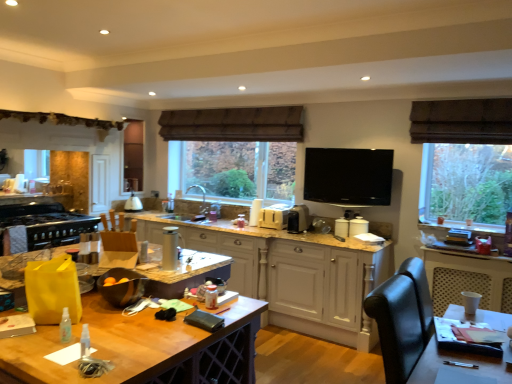
Question: Would you say white painted wood cabinetry at center is inside or outside matte white lampshade at center, positioned as the 6th appliance in front-to-back order?

Choices:
 (A) inside
 (B) outside

Answer: (B)

Question: Is white painted wood cabinetry at center in front of or behind matte white lampshade at center, the fifth appliance viewed from the right, in the image?

Choices:
 (A) front
 (B) behind

Answer: (A)

Question: Which is nearer to the satin silver toaster at center, which appears as the 3th appliance when viewed from the back?

Choices:
 (A) white painted wood cabinetry at center
 (B) black matte stove at left, positioned as the first appliance in left-to-right order
 (C) silver metallic thermos at center, the 6th appliance viewed from the back
 (D) matte white lampshade at center, positioned as the 6th appliance in front-to-back order
 (E) wooden table at center

Answer: (A)

Question: Estimate the real-world distances between objects in this image. Which object is closer to the silver metallic thermos at center, marked as the 1th appliance in a front-to-back arrangement?

Choices:
 (A) white painted wood cabinetry at center
 (B) white plastic toaster at center, positioned as the 4th appliance in left-to-right order
 (C) wooden table at center
 (D) satin silver toaster at center, the fourth appliance positioned from the front
 (E) flat screen tv at upper center, the 4th appliance in the back-to-front sequence

Answer: (C)